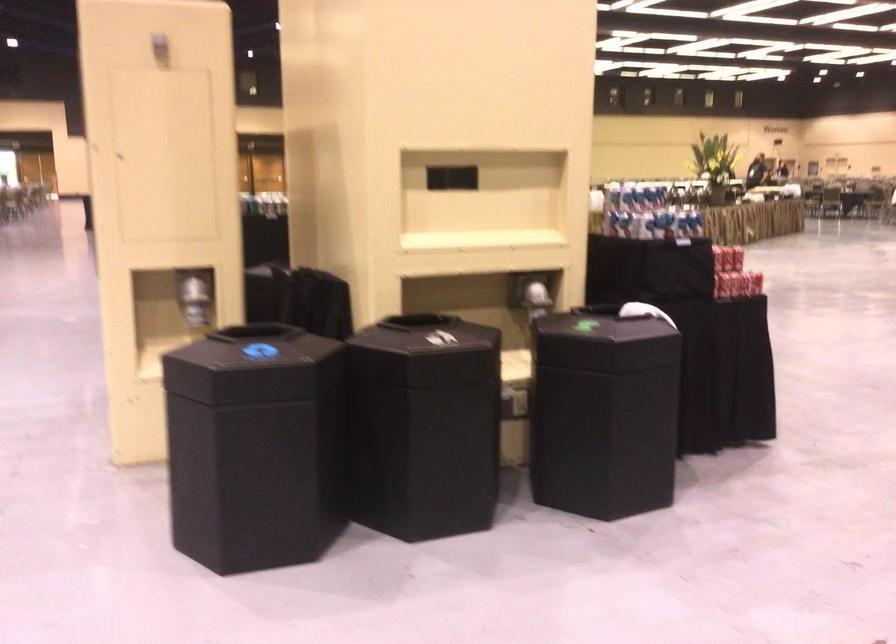
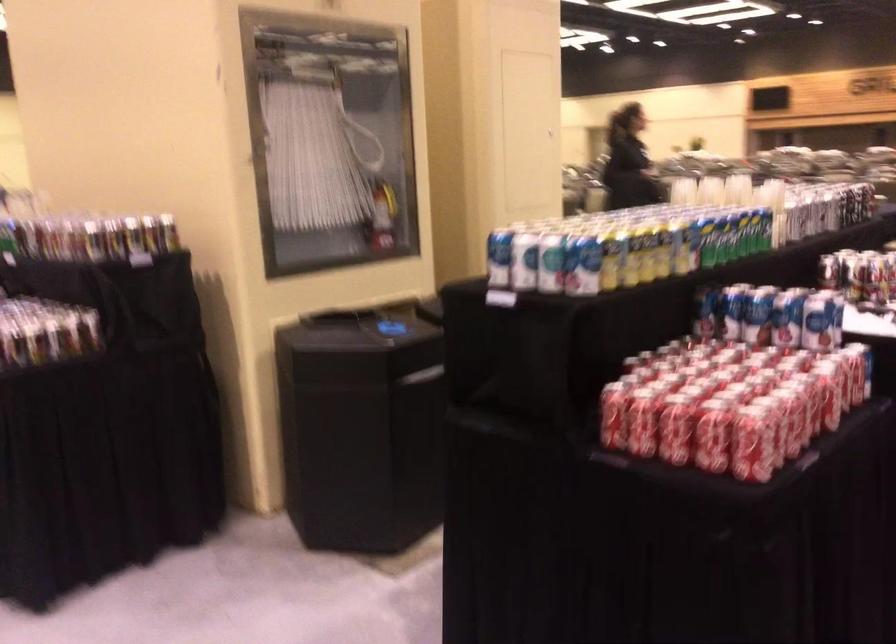
Question: I am providing you with two images of the same scene from different viewpoints. Please identify which objects are invisible in image2.

Choices:
 (A) red fire extinguisher
 (B) black bin lid
 (C) patterned kettle handle
 (D) red soda can

Answer: (B)